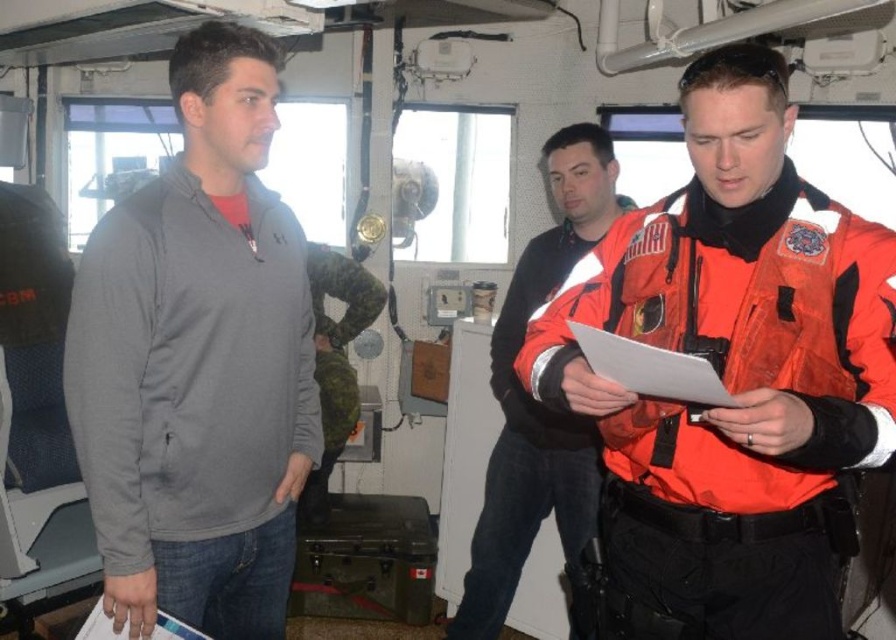
You are a maintenance technician standing at the camera position in the ship bridge. You need to reach a control panel located at point [134,484]. Can you safely reach it without moving your position?

The distance of point [134,484] from the camera is 1.62 meters. Since the technician is at the camera position, they can safely reach the control panel at point [134,484] as the distance is within a comfortable reach range.